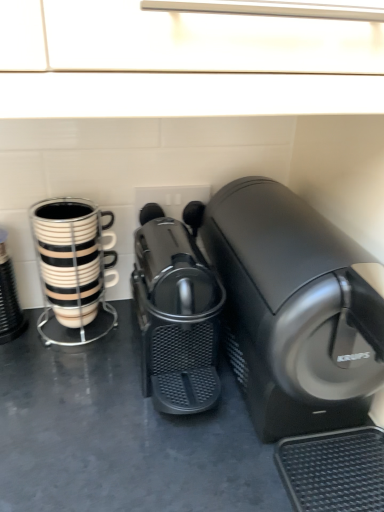
Question: Considering the relative sizes of black glossy coffee cup at left and black plastic coffee machine at center, the 2th home appliance positioned from the left, in the image provided, is black glossy coffee cup at left shorter than black plastic coffee machine at center, the 2th home appliance positioned from the left,?

Choices:
 (A) no
 (B) yes

Answer: (B)

Question: Is black plastic coffee machine at center, marked as the first home appliance in a right-to-left arrangement, completely or partially inside black glossy coffee cup at left?

Choices:
 (A) yes
 (B) no

Answer: (B)

Question: Is black glossy coffee cup at left smaller than black plastic coffee machine at center, the 2th home appliance positioned from the left?

Choices:
 (A) yes
 (B) no

Answer: (A)

Question: Is black glossy coffee cup at left positioned with its back to black plastic coffee machine at center, marked as the first home appliance in a right-to-left arrangement?

Choices:
 (A) yes
 (B) no

Answer: (B)

Question: Can you confirm if black glossy coffee cup at left is taller than black plastic coffee machine at center, marked as the first home appliance in a right-to-left arrangement?

Choices:
 (A) no
 (B) yes

Answer: (A)

Question: From the image's perspective, relative to black and white striped mug at left, is black plastic coffee machine at center, marked as the first home appliance in a right-to-left arrangement, above or below?

Choices:
 (A) above
 (B) below

Answer: (B)

Question: In terms of width, does black plastic coffee machine at center, marked as the first home appliance in a right-to-left arrangement, look wider or thinner when compared to black and white striped mug at left?

Choices:
 (A) wide
 (B) thin

Answer: (A)

Question: Is black plastic coffee machine at center, marked as the first home appliance in a right-to-left arrangement, situated inside black and white striped mug at left or outside?

Choices:
 (A) outside
 (B) inside

Answer: (A)

Question: In terms of height, does black plastic coffee machine at center, the 2th home appliance positioned from the left, look taller or shorter compared to black and white striped mug at left?

Choices:
 (A) short
 (B) tall

Answer: (B)

Question: Relative to black plastic coffee machine at center, marked as the first home appliance in a right-to-left arrangement, is black glossy coffee cup at left in front or behind?

Choices:
 (A) front
 (B) behind

Answer: (B)

Question: From a real-world perspective, is black glossy coffee cup at left positioned above or below black plastic coffee machine at center, the 2th home appliance positioned from the left?

Choices:
 (A) below
 (B) above

Answer: (A)

Question: Is black glossy coffee cup at left wider or thinner than black plastic coffee machine at center, marked as the first home appliance in a right-to-left arrangement?

Choices:
 (A) thin
 (B) wide

Answer: (A)

Question: From the image's perspective, is black glossy coffee cup at left positioned above or below black plastic coffee machine at center, the 2th home appliance positioned from the left?

Choices:
 (A) below
 (B) above

Answer: (A)

Question: From the image's perspective, is black and white striped mug at left positioned above or below black glossy coffee cup at left?

Choices:
 (A) above
 (B) below

Answer: (A)

Question: Does point (91, 272) appear closer or farther from the camera than point (3, 287)?

Choices:
 (A) farther
 (B) closer

Answer: (A)